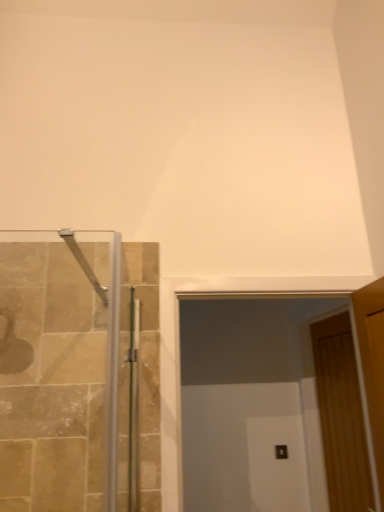
Question: Is wooden door at right looking in the opposite direction of transparent glass door at center?

Choices:
 (A) yes
 (B) no

Answer: (B)

Question: Does wooden door at right turn towards transparent glass door at center?

Choices:
 (A) yes
 (B) no

Answer: (B)

Question: Does wooden door at right have a greater width compared to transparent glass door at center?

Choices:
 (A) no
 (B) yes

Answer: (A)

Question: From a real-world perspective, is wooden door at right located beneath transparent glass door at center?

Choices:
 (A) yes
 (B) no

Answer: (A)

Question: Does wooden door at right have a larger size compared to transparent glass door at center?

Choices:
 (A) no
 (B) yes

Answer: (A)

Question: Would you say transparent glass door at center is part of wooden door at right's contents?

Choices:
 (A) no
 (B) yes

Answer: (A)

Question: Is wooden door at right completely or partially inside transparent glass door at center?

Choices:
 (A) no
 (B) yes

Answer: (A)

Question: Is transparent glass door at center not inside wooden door at right?

Choices:
 (A) no
 (B) yes

Answer: (B)

Question: Is transparent glass door at center touching wooden door at right?

Choices:
 (A) no
 (B) yes

Answer: (A)

Question: Is transparent glass door at center shorter than wooden door at right?

Choices:
 (A) yes
 (B) no

Answer: (A)

Question: From the image's perspective, is transparent glass door at center above wooden door at right?

Choices:
 (A) yes
 (B) no

Answer: (A)

Question: From a real-world perspective, does transparent glass door at center sit lower than wooden door at right?

Choices:
 (A) yes
 (B) no

Answer: (B)

Question: Would you say wooden door at right is inside or outside transparent glass door at center?

Choices:
 (A) outside
 (B) inside

Answer: (A)